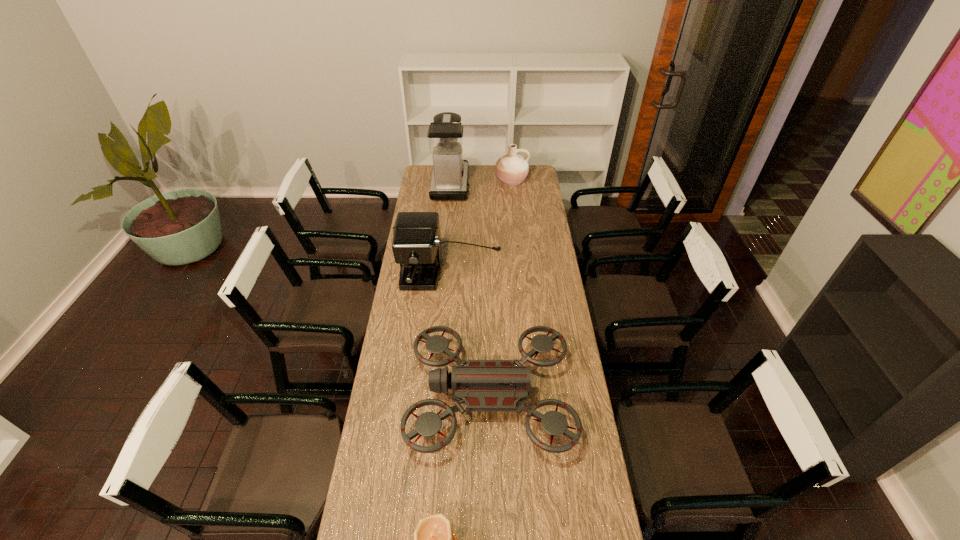
The height and width of the screenshot is (540, 960). In the image, there is a desktop. In order to click on vacant space at the far right corner in this screenshot , I will do `click(538, 166)`.

You are a GUI agent. You are given a task and a screenshot of the screen. Output one action in this format:
    pyautogui.click(x=<x>, y=<y>)
    Task: Click on the vacant space that's between the third tallest object and the taller coffee maker
    Image resolution: width=960 pixels, height=540 pixels.
    Given the screenshot: What is the action you would take?
    pyautogui.click(x=481, y=183)

Where is `vacant point located between the drone and the farther coffee maker`? This screenshot has width=960, height=540. vacant point located between the drone and the farther coffee maker is located at coordinates (470, 291).

Image resolution: width=960 pixels, height=540 pixels. Find the location of `free space between the farther coffee maker and the third farthest object`. free space between the farther coffee maker and the third farthest object is located at coordinates [x=451, y=227].

The width and height of the screenshot is (960, 540). I want to click on free spot between the drone and the nearer coffee maker, so click(x=470, y=334).

What are the coordinates of `free spot between the pottery and the tallest object` in the screenshot? It's located at (481, 183).

You are a GUI agent. You are given a task and a screenshot of the screen. Output one action in this format:
    pyautogui.click(x=<x>, y=<y>)
    Task: Click on the free space between the pottery and the third farthest object
    This screenshot has width=960, height=540.
    Given the screenshot: What is the action you would take?
    481,225

Where is `free space that is in between the second nearest object and the pottery`? Image resolution: width=960 pixels, height=540 pixels. free space that is in between the second nearest object and the pottery is located at coordinates (500, 288).

The height and width of the screenshot is (540, 960). I want to click on object identified as the fourth closest to the drone, so click(511, 169).

Identify which object is the closest to the drone. Please provide its 2D coordinates. Your answer should be formatted as a tuple, i.e. [(x, y)], where the tuple contains the x and y coordinates of a point satisfying the conditions above.

[(433, 539)]